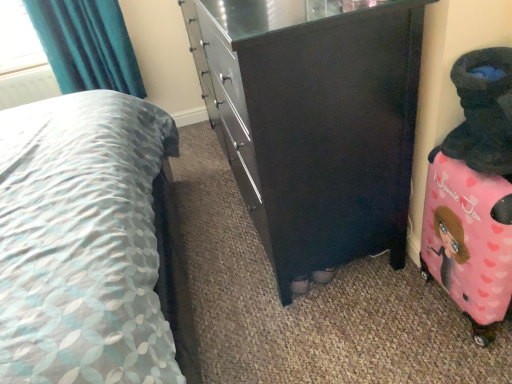
Question: Is pink fabric suitcase at right to the left of teal fabric curtain at upper left from the viewer's perspective?

Choices:
 (A) no
 (B) yes

Answer: (A)

Question: Considering the relative sizes of pink fabric suitcase at right and teal fabric curtain at upper left in the image provided, is pink fabric suitcase at right smaller than teal fabric curtain at upper left?

Choices:
 (A) no
 (B) yes

Answer: (B)

Question: Does pink fabric suitcase at right have a lesser width compared to teal fabric curtain at upper left?

Choices:
 (A) yes
 (B) no

Answer: (B)

Question: From a real-world perspective, does pink fabric suitcase at right sit lower than teal fabric curtain at upper left?

Choices:
 (A) no
 (B) yes

Answer: (B)

Question: Does pink fabric suitcase at right have a greater height compared to teal fabric curtain at upper left?

Choices:
 (A) no
 (B) yes

Answer: (A)

Question: Is point (265, 34) positioned closer to the camera than point (425, 205)?

Choices:
 (A) farther
 (B) closer

Answer: (B)

Question: Looking at their shapes, would you say matte black dresser at center is wider or thinner than pink fabric suitcase at right?

Choices:
 (A) thin
 (B) wide

Answer: (B)

Question: Considering the positions of matte black dresser at center and pink fabric suitcase at right in the image, is matte black dresser at center bigger or smaller than pink fabric suitcase at right?

Choices:
 (A) big
 (B) small

Answer: (A)

Question: In terms of height, does matte black dresser at center look taller or shorter compared to pink fabric suitcase at right?

Choices:
 (A) short
 (B) tall

Answer: (B)

Question: Relative to matte black dresser at center, is pink fabric suitcase at right in front or behind?

Choices:
 (A) front
 (B) behind

Answer: (B)

Question: In terms of height, does pink fabric suitcase at right look taller or shorter compared to matte black dresser at center?

Choices:
 (A) short
 (B) tall

Answer: (A)

Question: Would you say pink fabric suitcase at right is to the left or to the right of matte black dresser at center in the picture?

Choices:
 (A) right
 (B) left

Answer: (A)

Question: Looking at their shapes, would you say pink fabric suitcase at right is wider or thinner than matte black dresser at center?

Choices:
 (A) thin
 (B) wide

Answer: (A)

Question: In the image, is matte black dresser at center on the left side or the right side of patterned fabric bed at center?

Choices:
 (A) right
 (B) left

Answer: (A)

Question: Considering the positions of matte black dresser at center and patterned fabric bed at center in the image, is matte black dresser at center wider or thinner than patterned fabric bed at center?

Choices:
 (A) wide
 (B) thin

Answer: (B)